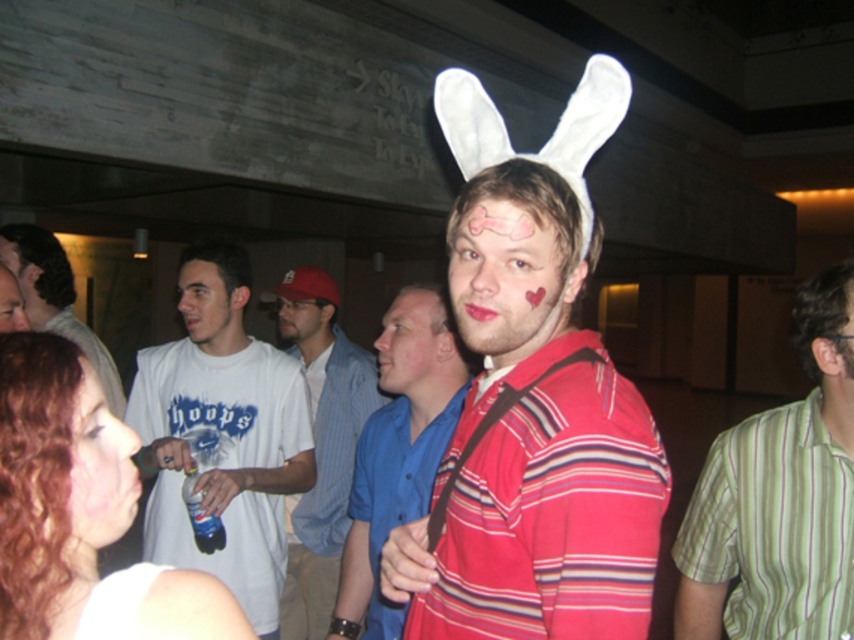
You are at the event and want to take a photo of the man with both the smooth skin face at center and the matte white cap at center in the frame. Which object should you position closer to the left side of the camera to ensure both are visible?

You should position the matte white cap at center closer to the left side of the camera because the smooth skin face at center is to the right of the matte white cap at center, so moving the cap left will keep both in frame.

You are at a social gathering and want to locate the tallest person between the green striped shirt at right and the white shirt at center. Which one should you look towards?

The green striped shirt at right is much taller than the white shirt at center, so you should look towards the green striped shirt at right.

You are at a party and want to find the person wearing a green striped shirt at right. Which direction should you look relative to the person in the white shirt at center?

The green striped shirt at right is below the white shirt at center, so you should look downward from the white shirt at center to find the green striped shirt at right.